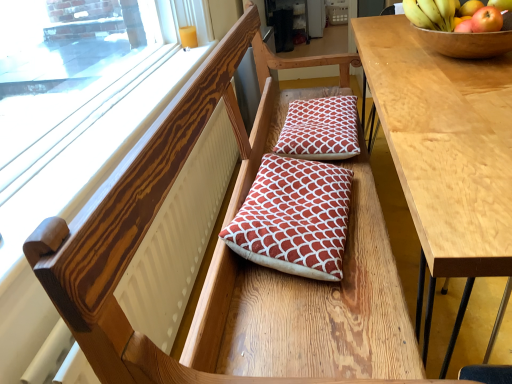
Question: Does wooden bowl at upper right contain light brown wood table at right?

Choices:
 (A) yes
 (B) no

Answer: (B)

Question: Considering the relative positions of wooden bowl at upper right and light brown wood table at right in the image provided, is wooden bowl at upper right in front of light brown wood table at right?

Choices:
 (A) yes
 (B) no

Answer: (B)

Question: Considering the relative positions of wooden bowl at upper right and light brown wood table at right in the image provided, is wooden bowl at upper right to the left of light brown wood table at right from the viewer's perspective?

Choices:
 (A) yes
 (B) no

Answer: (A)

Question: Does wooden bowl at upper right appear on the right side of light brown wood table at right?

Choices:
 (A) no
 (B) yes

Answer: (A)

Question: Does wooden bowl at upper right have a greater width compared to light brown wood table at right?

Choices:
 (A) no
 (B) yes

Answer: (A)

Question: Is point (317, 188) closer or farther from the camera than point (291, 114)?

Choices:
 (A) farther
 (B) closer

Answer: (B)

Question: Is red textured cushion at center, positioned as the first pillow in bottom-to-top order, spatially inside red quilted cushion at center, the 1th pillow positioned from the top, or outside of it?

Choices:
 (A) outside
 (B) inside

Answer: (A)

Question: Is red textured cushion at center, which appears as the 2th pillow when viewed from the top, wider or thinner than red quilted cushion at center, the 2th pillow from the bottom?

Choices:
 (A) thin
 (B) wide

Answer: (B)

Question: Considering their positions, is red textured cushion at center, positioned as the first pillow in bottom-to-top order, located in front of or behind red quilted cushion at center, placed as the second pillow when sorted from front to back?

Choices:
 (A) behind
 (B) front

Answer: (B)

Question: In the image, is red textured cushion at center, which appears as the 2th pillow when viewed from the top, positioned in front of or behind light brown wood table at right?

Choices:
 (A) front
 (B) behind

Answer: (B)

Question: Is point (295, 233) positioned closer to the camera than point (485, 223)?

Choices:
 (A) closer
 (B) farther

Answer: (B)

Question: Is red textured cushion at center, the 1th pillow in the front-to-back sequence, to the left or to the right of light brown wood table at right in the image?

Choices:
 (A) left
 (B) right

Answer: (A)

Question: Is red textured cushion at center, positioned as the first pillow in bottom-to-top order, bigger or smaller than light brown wood table at right?

Choices:
 (A) big
 (B) small

Answer: (B)

Question: Visually, is wooden frame at upper left positioned to the left or to the right of wooden bowl at upper right?

Choices:
 (A) left
 (B) right

Answer: (A)

Question: Would you say wooden frame at upper left is inside or outside wooden bowl at upper right?

Choices:
 (A) outside
 (B) inside

Answer: (A)